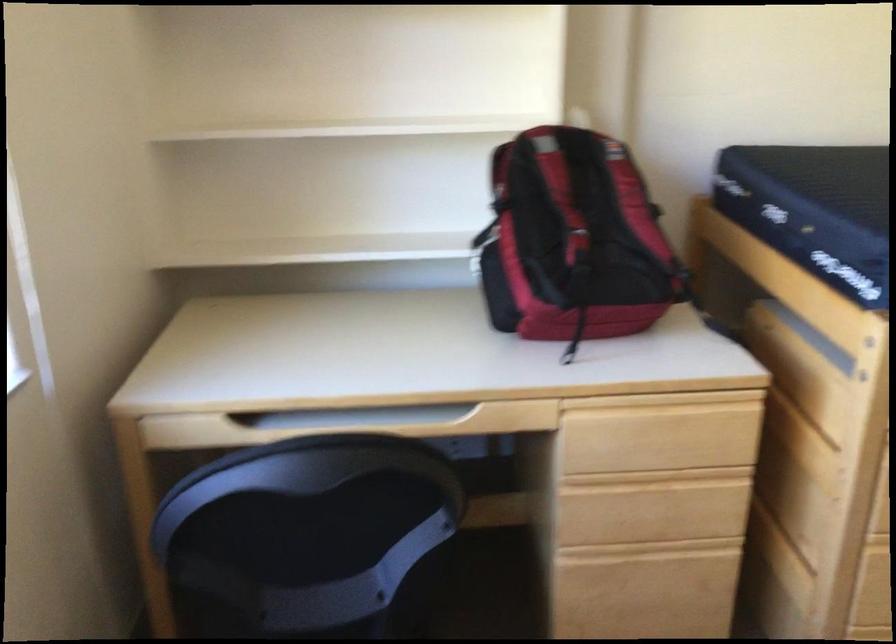
Describe the element at coordinates (573, 241) in the screenshot. I see `the red and black backpack` at that location.